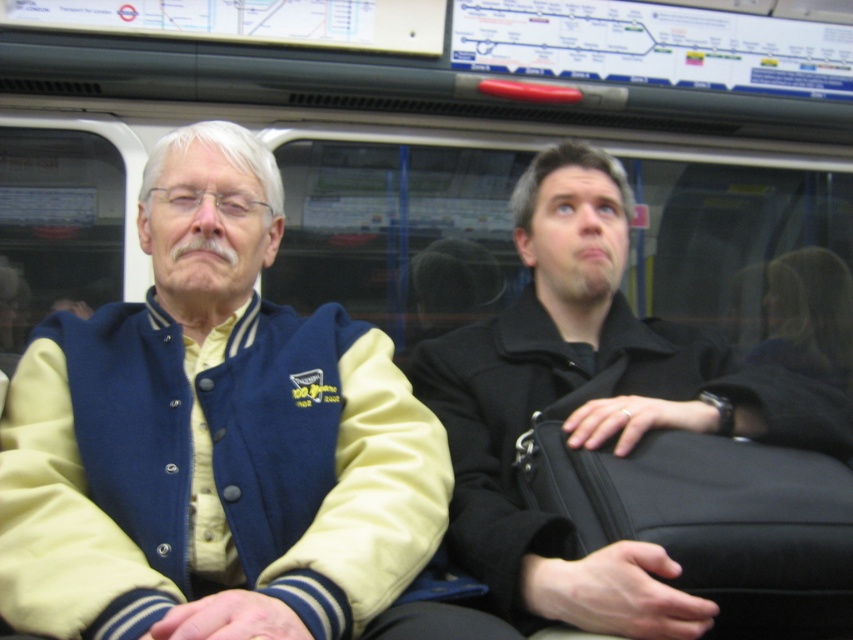
You are a passenger on a train and need to store your items in the overhead compartment. The overhead compartment has a width of 40 cm. You have the black leather jacket at center and the black fabric suitcase at right. Which item can fit in the compartment based on their widths?

The black fabric suitcase at right can fit in the overhead compartment since the black leather jacket at center is wider than it, and the compartment is only 40 cm wide.

You are a passenger on a train and need to place your backpack between the varnished leather jacket at center and the black fabric suitcase at right. Can you fit it there?

The varnished leather jacket at center is closer to the viewer than the black fabric suitcase at right, so there may be enough space between them to fit your backpack, but the exact distance isn not specified.

Consider the image. You are standing at the entrance of the train car and see the varnished leather jacket at center. If you walk directly towards it, will you pass through the area marked by the point at coordinates (212, 444)?

The point at coordinates (212, 444) corresponds to the varnished leather jacket at center, so walking directly towards it would mean passing through that point.